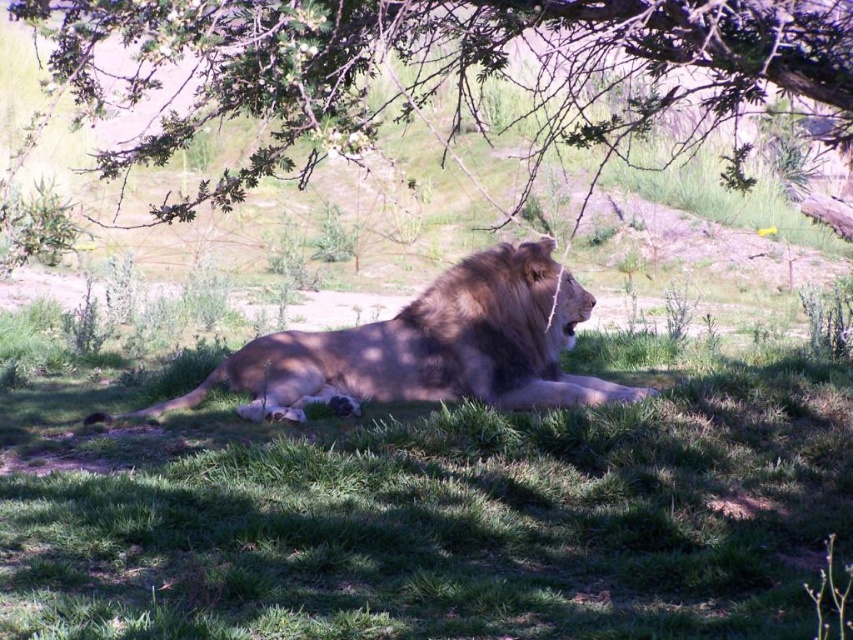
Question: Does green leafy branches at upper center appear on the left side of golden brown fur lion at center?

Choices:
 (A) yes
 (B) no

Answer: (B)

Question: Where is green leafy branches at upper center located in relation to golden brown fur lion at center in the image?

Choices:
 (A) above
 (B) below

Answer: (A)

Question: Which object appears farthest from the camera in this image?

Choices:
 (A) golden brown fur lion at center
 (B) green grassy at center
 (C) green leafy branches at upper center

Answer: (A)

Question: Is green grassy at center behind golden brown fur lion at center?

Choices:
 (A) no
 (B) yes

Answer: (A)

Question: Which is nearer to the golden brown fur lion at center?

Choices:
 (A) green leafy branches at upper center
 (B) green grassy at center

Answer: (B)

Question: Estimate the real-world distances between objects in this image. Which object is closer to the green leafy branches at upper center?

Choices:
 (A) green grassy at center
 (B) golden brown fur lion at center

Answer: (B)